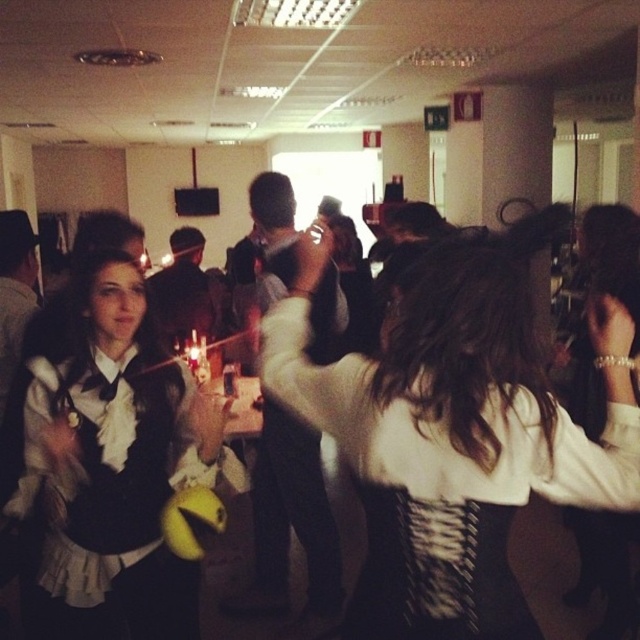
Measure the distance between white textured fabric at center and camera.

white textured fabric at center is 3.72 feet away from camera.

Is white textured fabric at center above matte black dress at center?

Yes, white textured fabric at center is above matte black dress at center.

Who is more forward, (512, 417) or (80, 524)?

Point (512, 417) is more forward.

The width and height of the screenshot is (640, 640). I want to click on white textured fabric at center, so click(x=458, y=422).